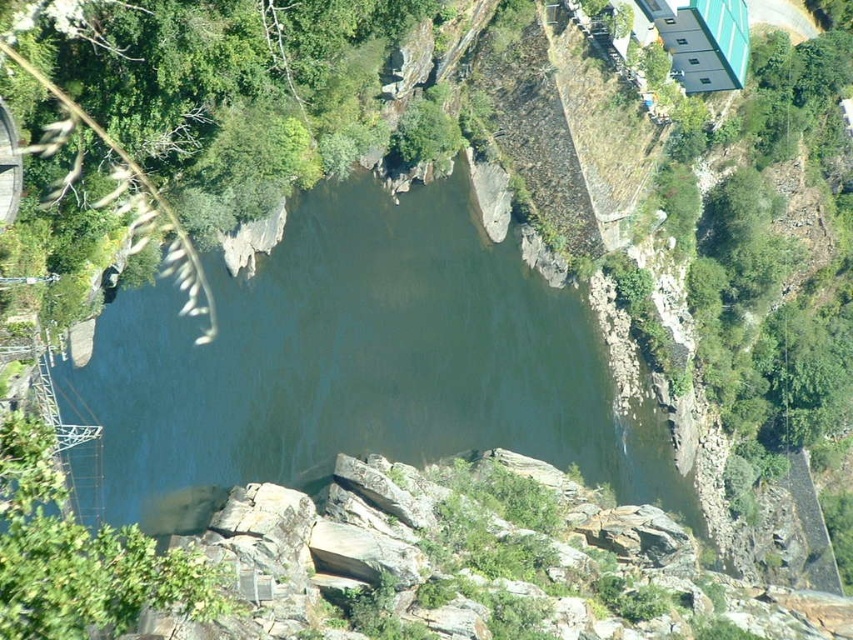
Is greenish-gray water at center thinner than green leafy vegetation at upper left?

In fact, greenish-gray water at center might be wider than green leafy vegetation at upper left.

In order to click on greenish-gray water at center in this screenshot , I will do `click(352, 365)`.